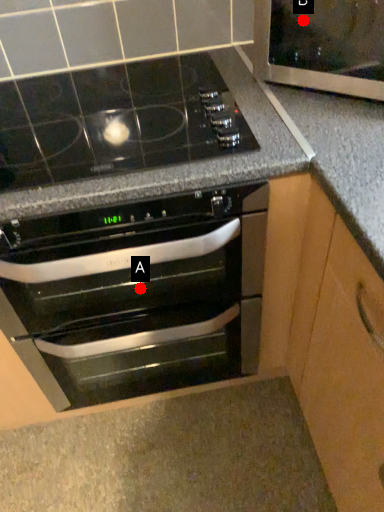
Question: Two points are circled on the image, labeled by A and B beside each circle. Among these points, which one is farthest from the camera?

Choices:
 (A) A is further
 (B) B is further

Answer: (A)